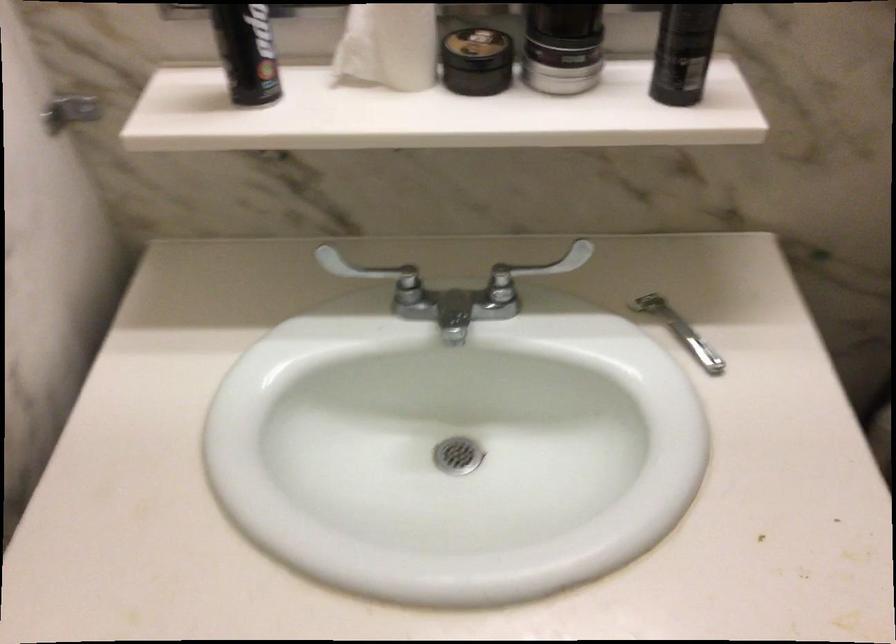
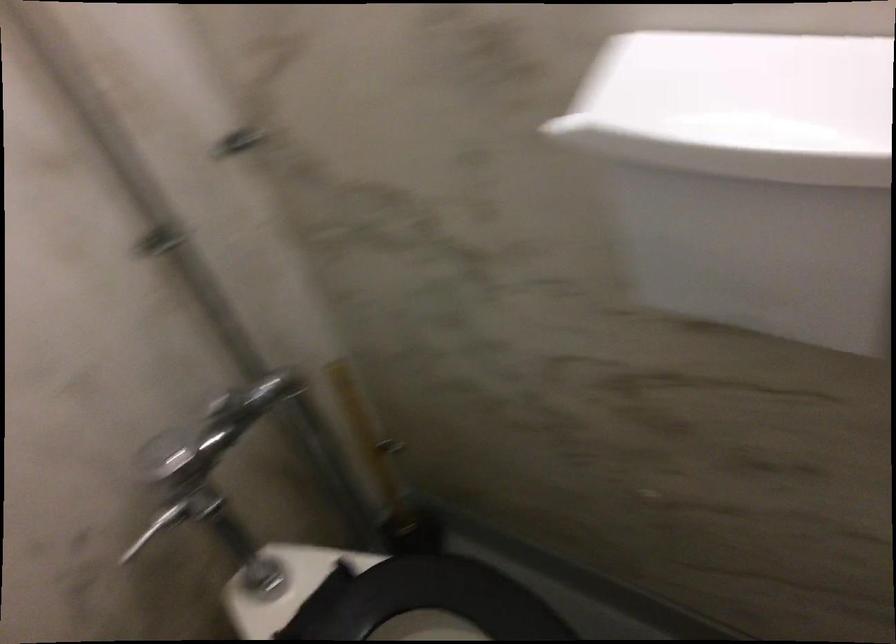
Question: The images are taken continuously from a first-person perspective. In which direction is your viewpoint rotating?

Choices:
 (A) Left
 (B) Right
 (C) Up
 (D) Down

Answer: (A)